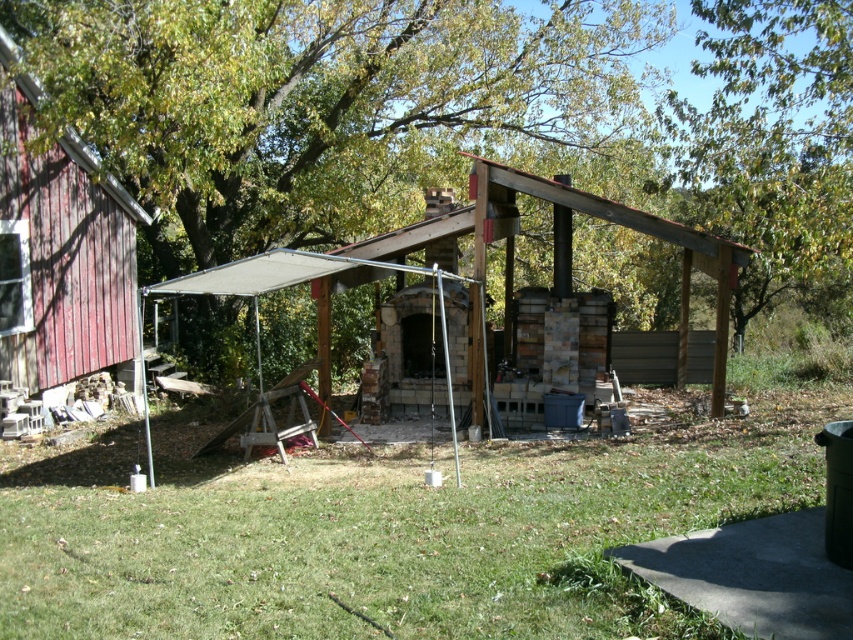
This screenshot has height=640, width=853. Describe the element at coordinates (399, 529) in the screenshot. I see `grass at lower center` at that location.

How distant is grass at lower center from wooden pergola at center?

grass at lower center and wooden pergola at center are 2.27 meters apart.

The image size is (853, 640). In order to click on grass at lower center in this screenshot , I will do `click(399, 529)`.

In order to click on grass at lower center in this screenshot , I will do `click(399, 529)`.

Which is more to the right, green leafy tree at upper center or rusty wood hut at left?

Positioned to the right is green leafy tree at upper center.

Based on the photo, does green leafy tree at upper center have a smaller size compared to rusty wood hut at left?

No, green leafy tree at upper center is not smaller than rusty wood hut at left.

Does point (804, 240) come in front of point (59, 337)?

Yes, it is.

This screenshot has width=853, height=640. I want to click on green leafy tree at upper center, so click(775, 148).

Does green leafy tree at upper center appear under wooden pergola at center?

Incorrect, green leafy tree at upper center is not positioned below wooden pergola at center.

Is green leafy tree at upper center above wooden pergola at center?

Correct, green leafy tree at upper center is located above wooden pergola at center.

Identify the location of green leafy tree at upper center. The image size is (853, 640). (775, 148).